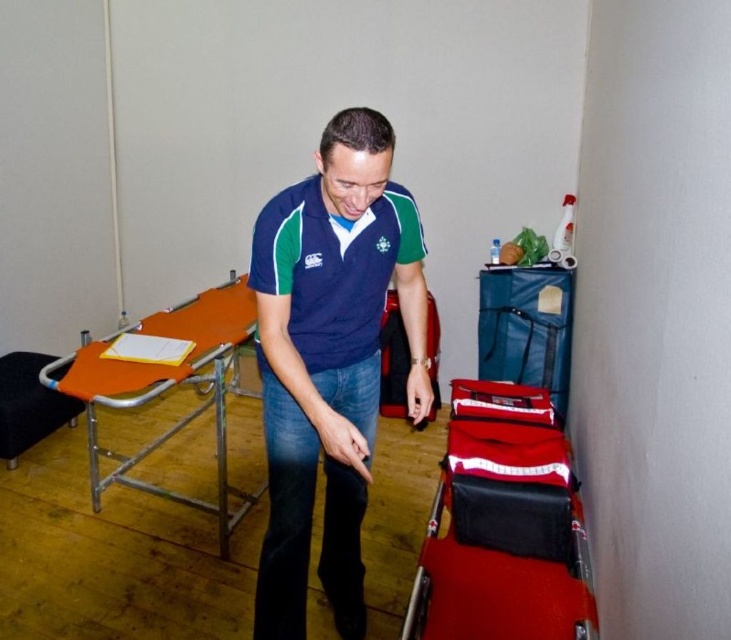
You are a physical therapist in a clinic and need to place a new piece of equipment between the navy blue jersey at center and the orange fabric stool at lower left. Considering their sizes, which object should you place closer to the wall to ensure there is enough space?

The navy blue jersey at center is wider than the orange fabric stool at lower left, so placing the navy blue jersey at center closer to the wall would leave more space between them for the new equipment.

Consider the image. You are a healthcare worker entering the room and need to retrieve a medical supply. You see the red plastic cart at lower right and the red leather suitcase at lower right. Which one is easier to reach without moving your current position?

The red plastic cart at lower right is closer to the viewer than the red leather suitcase at lower right, so it is easier to reach without moving.